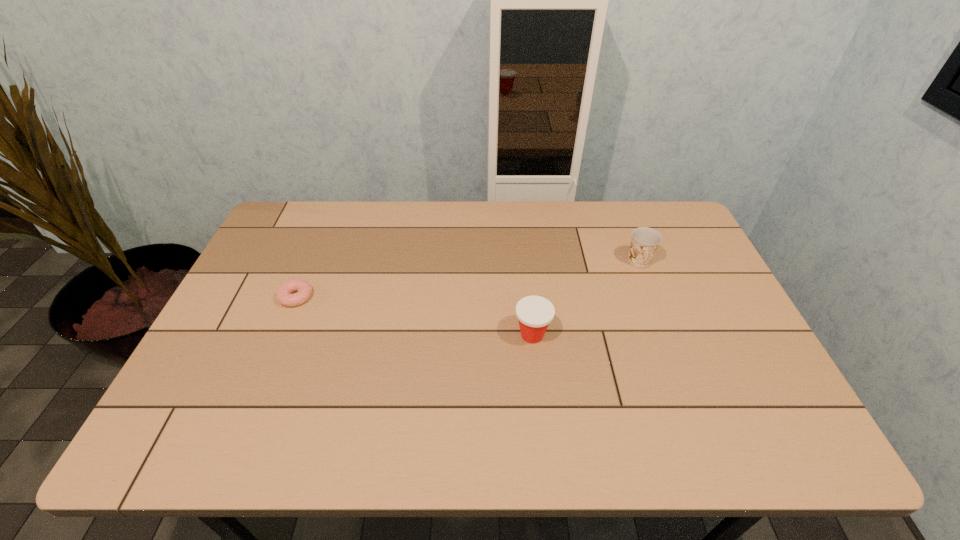
Identify the location of free space at the far edge. The width and height of the screenshot is (960, 540). (474, 238).

Image resolution: width=960 pixels, height=540 pixels. I want to click on free space at the near edge of the desktop, so click(431, 419).

In the image, there is a desktop. In order to click on free space at the left edge in this screenshot , I will do `click(265, 248)`.

In the image, there is a desktop. Where is `vacant space at the right edge`? The height and width of the screenshot is (540, 960). vacant space at the right edge is located at coordinates (773, 380).

Image resolution: width=960 pixels, height=540 pixels. I want to click on vacant region at the far left corner, so click(x=328, y=204).

I want to click on blank space at the far right corner of the desktop, so click(x=661, y=225).

Identify the location of vacant space at the near right corner. This screenshot has height=540, width=960. (744, 418).

Locate an element on the screen. The image size is (960, 540). vacant space in between the left Dixie cup and the leftmost object is located at coordinates (414, 316).

I want to click on free point between the second farthest object and the farthest object, so click(468, 279).

Identify the location of free area in between the leftmost object and the nearest object. (414, 316).